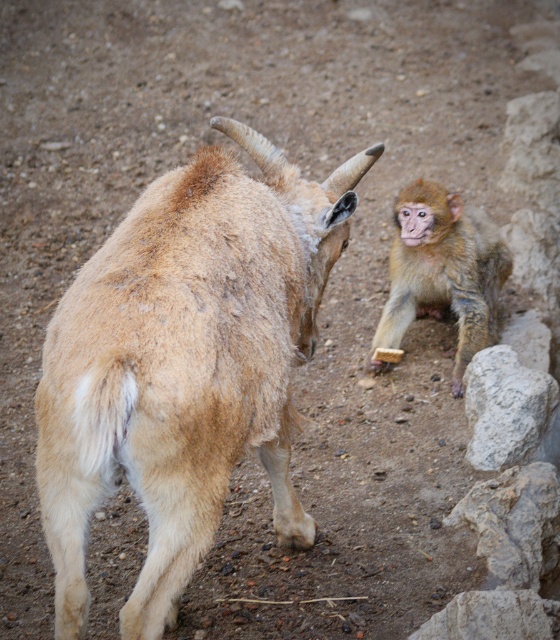
Who is positioned more to the left, brown woolen goat at center or light brown fur monkey at right?

From the viewer's perspective, brown woolen goat at center appears more on the left side.

Between brown woolen goat at center and light brown fur monkey at right, which one has less height?

Standing shorter between the two is light brown fur monkey at right.

Is point (95, 348) closer to viewer compared to point (380, 326)?

Yes.

Locate an element on the screen. The height and width of the screenshot is (640, 560). brown woolen goat at center is located at coordinates (184, 364).